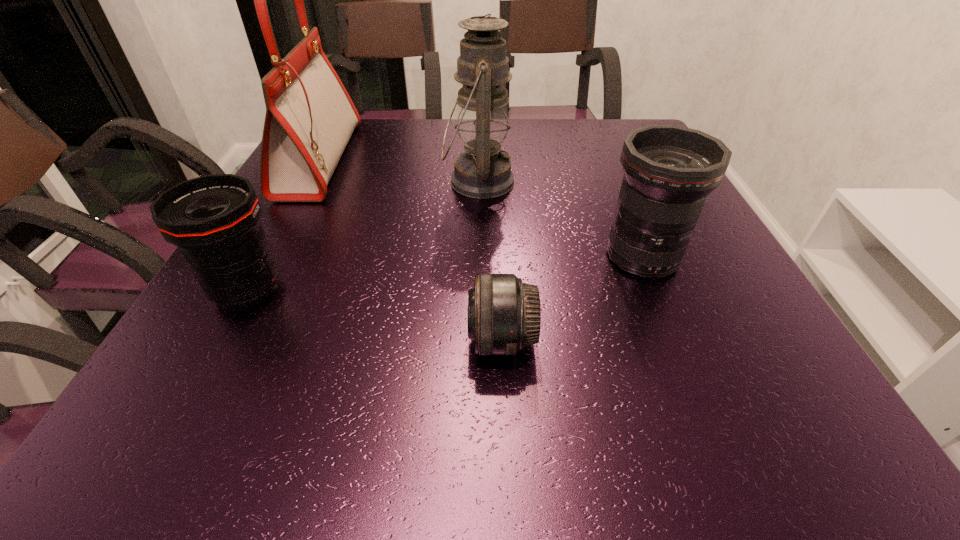
The width and height of the screenshot is (960, 540). I want to click on free location located 0.060m on the front of the rightmost object, so click(x=664, y=309).

Locate an element on the screen. The width and height of the screenshot is (960, 540). free space located on the back of the second shortest object is located at coordinates (300, 196).

I want to click on free space located on the front-facing side of the shortest telephoto lens, so click(272, 340).

You are a GUI agent. You are given a task and a screenshot of the screen. Output one action in this format:
    pyautogui.click(x=<x>, y=<y>)
    Task: Click on the free space located on the front-facing side of the shortest telephoto lens
    
    Given the screenshot: What is the action you would take?
    pyautogui.click(x=240, y=340)

Where is `blank space located on the front-facing side of the shortest telephoto lens`? This screenshot has width=960, height=540. blank space located on the front-facing side of the shortest telephoto lens is located at coordinates (290, 340).

The image size is (960, 540). I want to click on handbag present at the far edge, so click(310, 117).

Find the location of a particular element. The image size is (960, 540). oil lamp that is at the far edge is located at coordinates (482, 172).

Locate an element on the screen. The height and width of the screenshot is (540, 960). handbag that is at the left edge is located at coordinates (310, 117).

This screenshot has width=960, height=540. What are the coordinates of `telephoto lens at the left edge` in the screenshot? It's located at (214, 219).

Identify the location of object positioned at the right edge. Image resolution: width=960 pixels, height=540 pixels. 669,170.